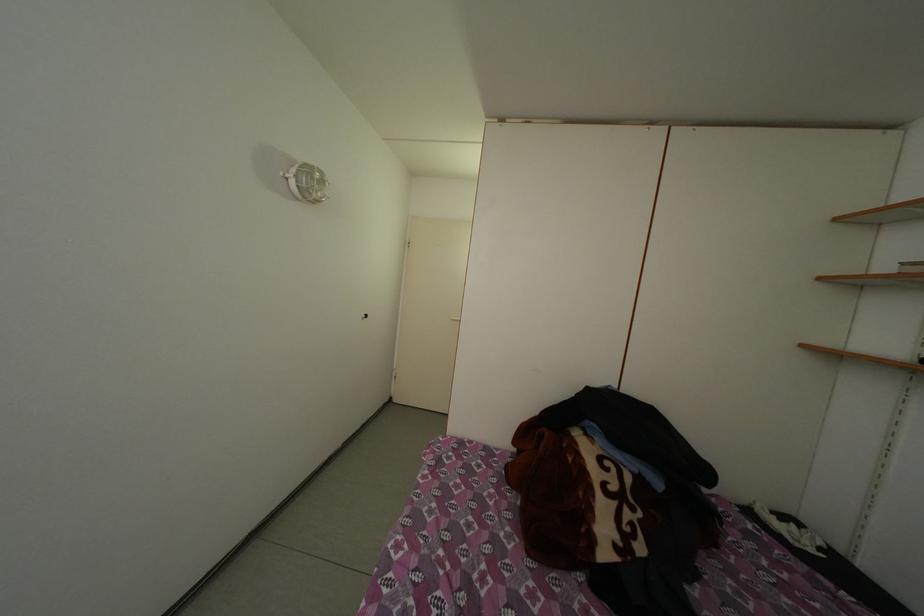
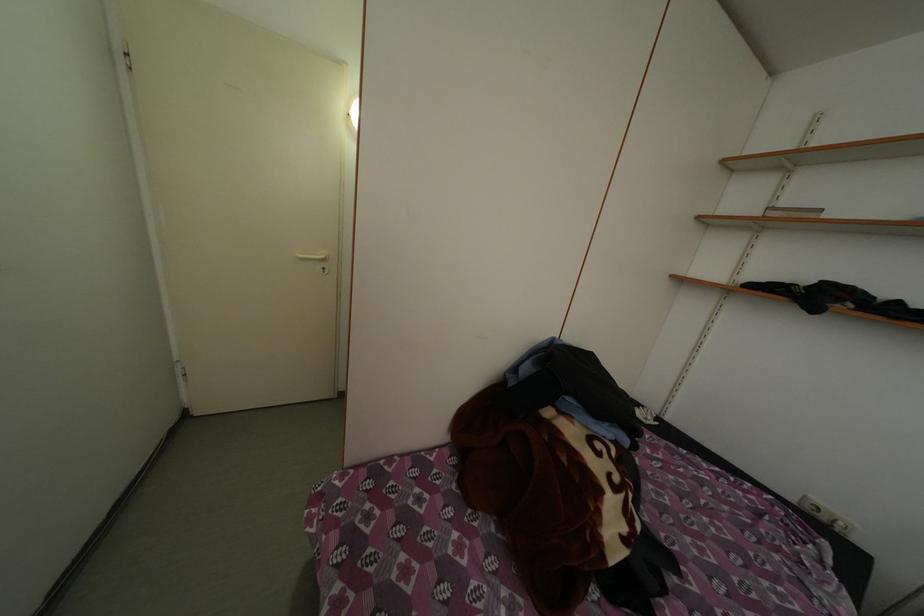
The first image is from the beginning of the video and the second image is from the end. How did the camera likely rotate when shooting the video?

The camera's rotation is toward right-down.